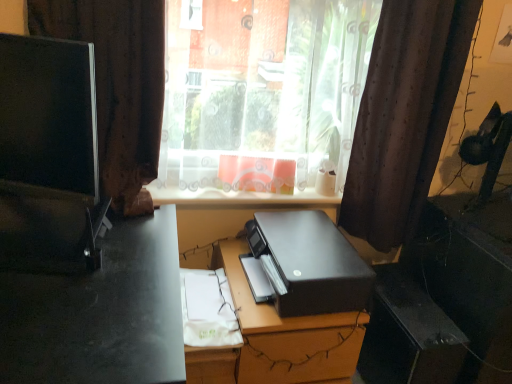
Locate an element on the screen. free space above matte black desk at left (from a real-world perspective) is located at coordinates (75, 276).